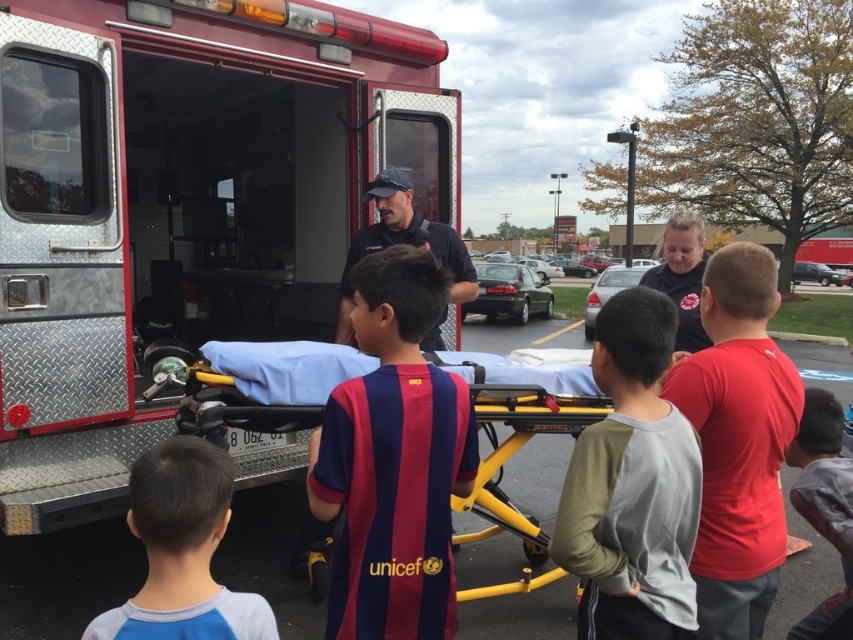
Locate an element on the screen. red cotton shirt at center is located at coordinates tap(737, 440).

Who is positioned more to the right, red cotton shirt at center or dark gray cotton shirt at lower right?

dark gray cotton shirt at lower right is more to the right.

Between point (709, 362) and point (827, 428), which one is positioned in front?

Point (709, 362) is more forward.

Where is `red cotton shirt at center`? red cotton shirt at center is located at coordinates (737, 440).

Between yellow metallic stretcher at center and dark gray cotton shirt at lower right, which one is positioned lower?

yellow metallic stretcher at center is lower down.

Which is behind, point (172, 381) or point (844, 566)?

The point (172, 381) is behind.

Is point (206, 371) farther from camera compared to point (805, 449)?

Yes.

Where is `yellow metallic stretcher at center`? Image resolution: width=853 pixels, height=640 pixels. yellow metallic stretcher at center is located at coordinates (509, 456).

Which is below, dark blue uniform at center or metallic silver ambulance at center?

dark blue uniform at center

Identify the location of dark blue uniform at center. (403, 243).

Find the location of a particular element. The image size is (853, 640). dark blue uniform at center is located at coordinates (403, 243).